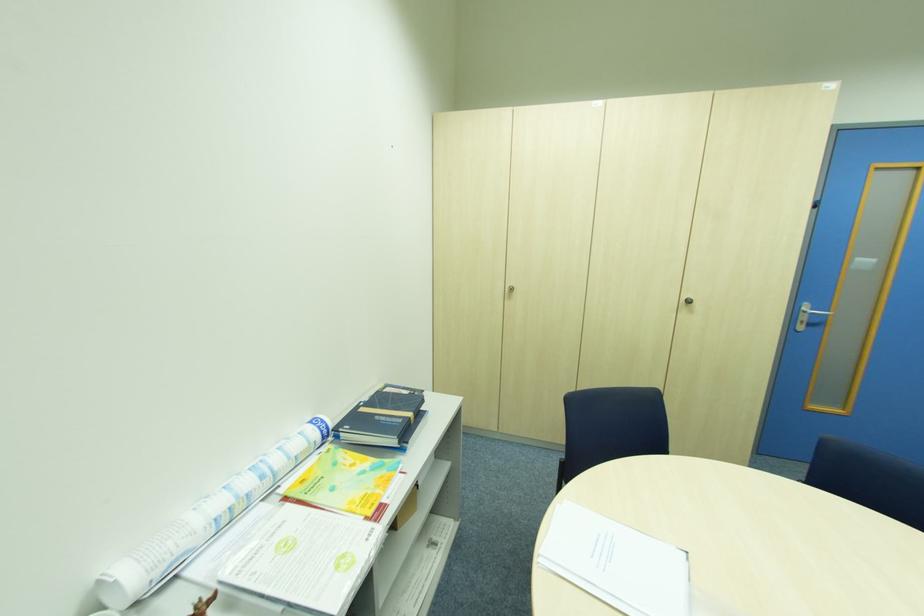
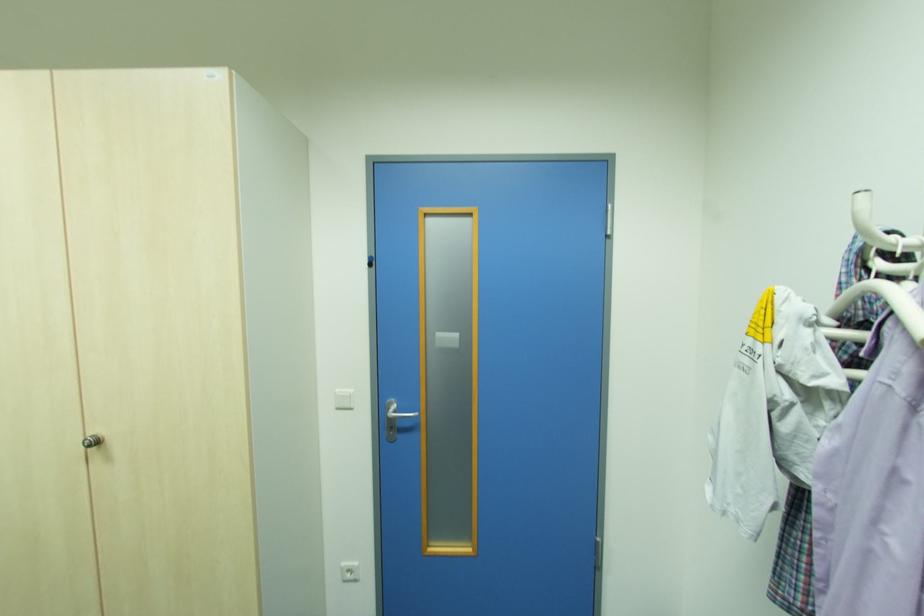
Question: In a continuous first-person perspective shot, in which direction is the camera moving?

Choices:
 (A) Left
 (B) Right
 (C) Forward
 (D) Backward

Answer: (B)